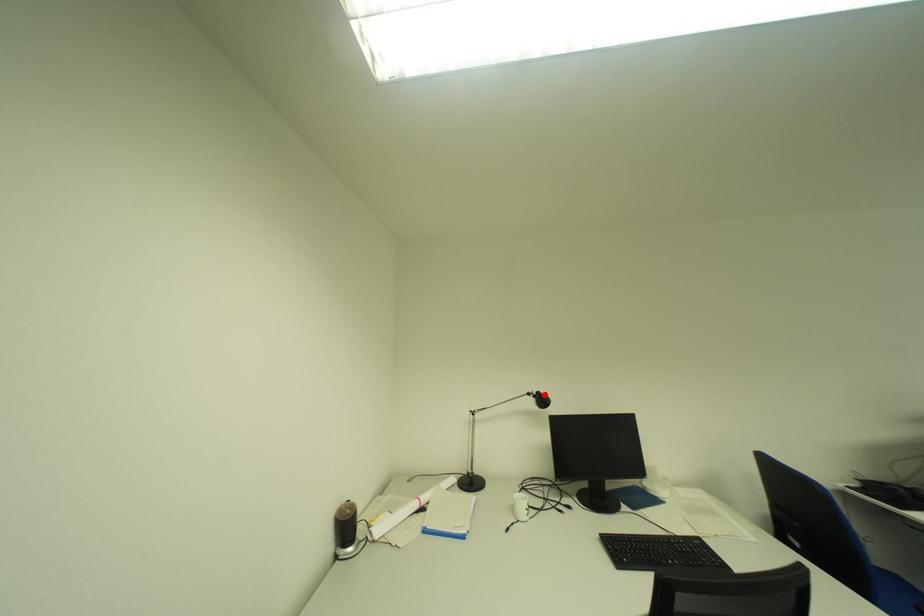
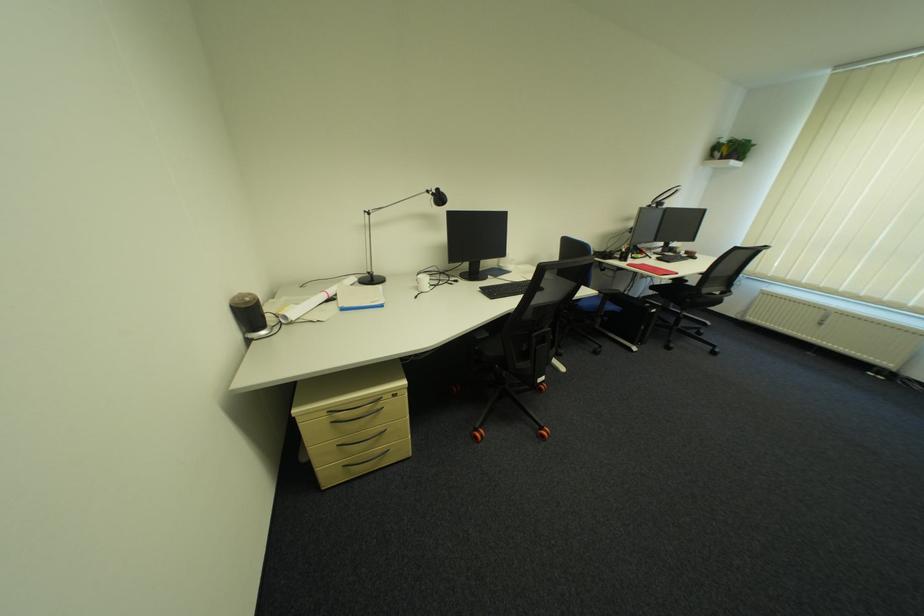
Where in the second image is the point corresponding to the highlighted location from the first image?

(444, 192)